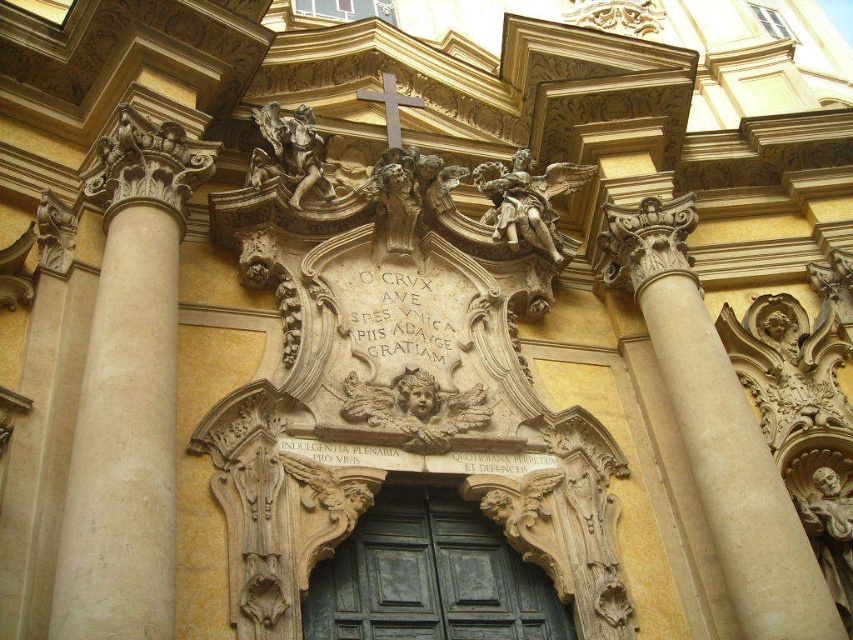
You are an architect designing a scale model of the church facade. The model will be 1 meter tall. If the polished bronze angel at upper center and golden polished cherub at upper center are 14.72 meters apart in the actual church, how far apart should they be in the model to maintain the same proportions?

The actual distance between the polished bronze angel at upper center and golden polished cherub at upper center is 14.72 meters. To maintain proportions in a 1 meter tall model, the distance between them should be 14.72 centimeters, as the scale is 1 meter to 14.72 meters, which simplifies to 1 cm to 14.72 meters.

Based on the scene description, what is located at the coordinates point [428,576]?

The point [428,576] indicates the green wood door at center.